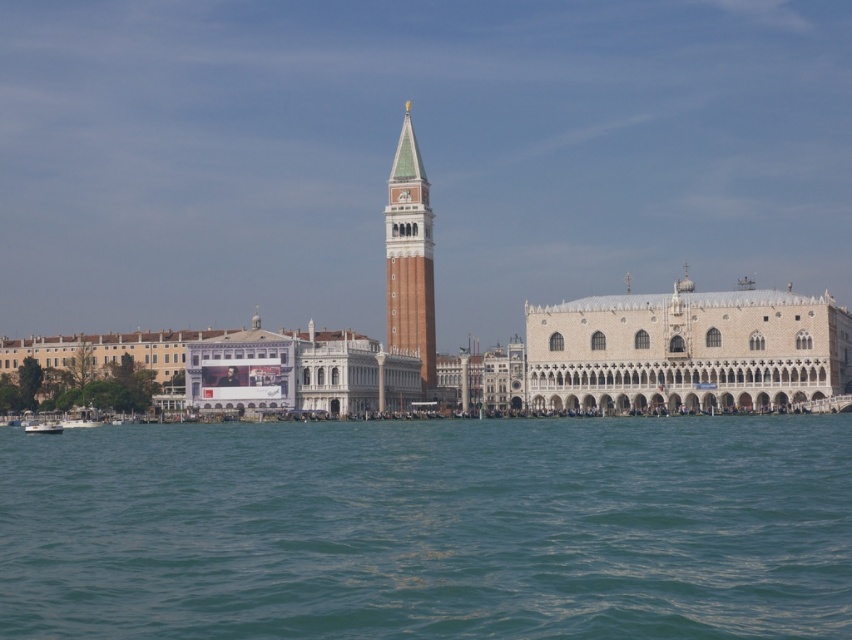
Question: Considering the relative positions of white stone palace at center and brick tower at center in the image provided, where is white stone palace at center located with respect to brick tower at center?

Choices:
 (A) above
 (B) below

Answer: (B)

Question: Which point appears closest to the camera in this image?

Choices:
 (A) (686, 435)
 (B) (426, 333)
 (C) (60, 424)

Answer: (A)

Question: From the image, what is the correct spatial relationship of brick tower at center in relation to white glossy boat at lower left?

Choices:
 (A) above
 (B) below

Answer: (A)

Question: Among these points, which one is farthest from the camera?

Choices:
 (A) (547, 317)
 (B) (56, 428)

Answer: (A)

Question: Is teal water at lower center above brick tower at center?

Choices:
 (A) no
 (B) yes

Answer: (A)

Question: Which point appears farthest from the camera in this image?

Choices:
 (A) (778, 291)
 (B) (119, 586)

Answer: (A)